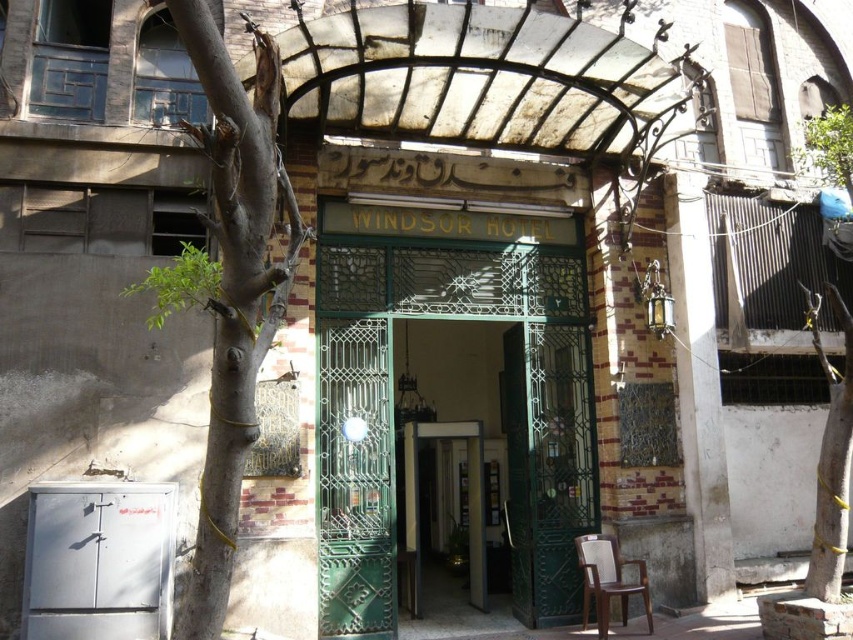
From the picture: You are a delivery person arriving at the Windsor Hotel entrance. You need to unload a package that requires passing through the green metal gate at center and the green textured bark at right. Which object has a larger width to allow the package to pass through?

The green metal gate at center has a larger width than the green textured bark at right, so the package can pass through the green metal gate at center more easily.

You are a delivery person trying to enter the Windsor Hotel through the entrance. You see the green metal gate at center and the brown wooden chair at lower right. Which object is bigger in size?

The green metal gate at center is larger in size than the brown wooden chair at lower right.

You are standing at the entrance of the Windsor Hotel and want to walk towards the point marked as point [824,593]. However, there is an obstacle at point [225,115]. Will you encounter this obstacle before reaching your destination?

Yes, you will encounter the obstacle at point [225,115] before reaching your destination at point [824,593] because point [225,115] is in front of point [824,593].